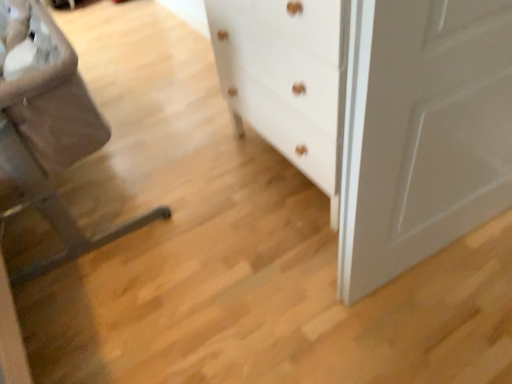
The width and height of the screenshot is (512, 384). In order to click on free spot in front of white matte chest of drawers at center in this screenshot , I will do `click(310, 273)`.